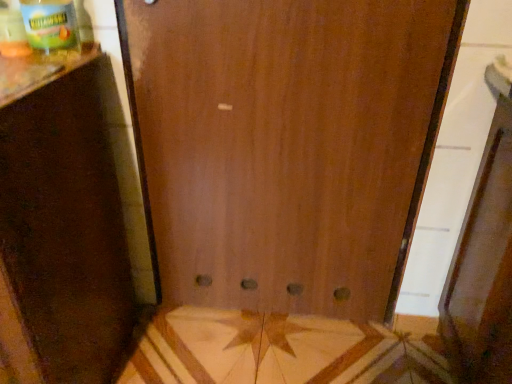
Find the location of a particular element. The height and width of the screenshot is (384, 512). green matte bottle at upper left is located at coordinates coord(50,25).

Describe the element at coordinates (50, 25) in the screenshot. The height and width of the screenshot is (384, 512). I see `green matte bottle at upper left` at that location.

Where is `green matte bottle at upper left`? green matte bottle at upper left is located at coordinates (50, 25).